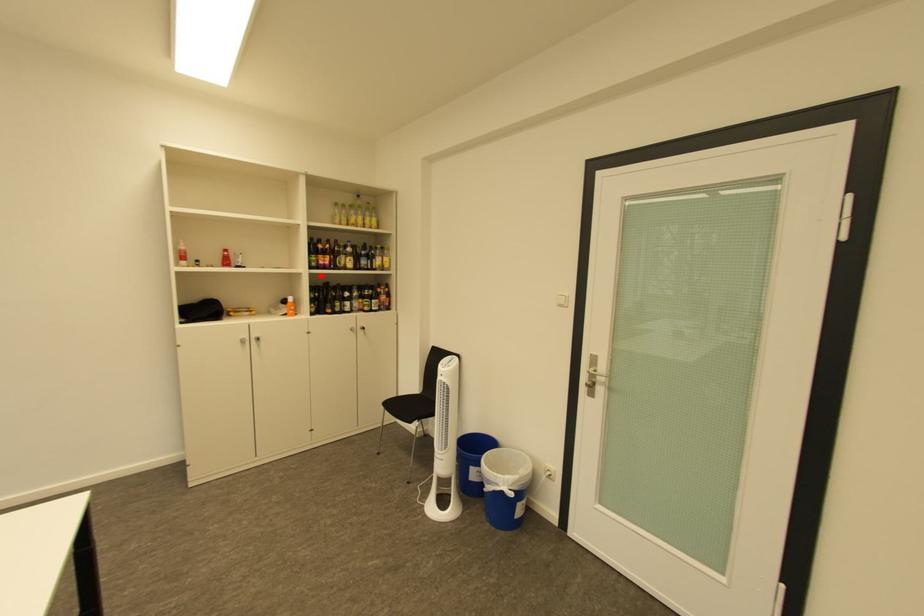
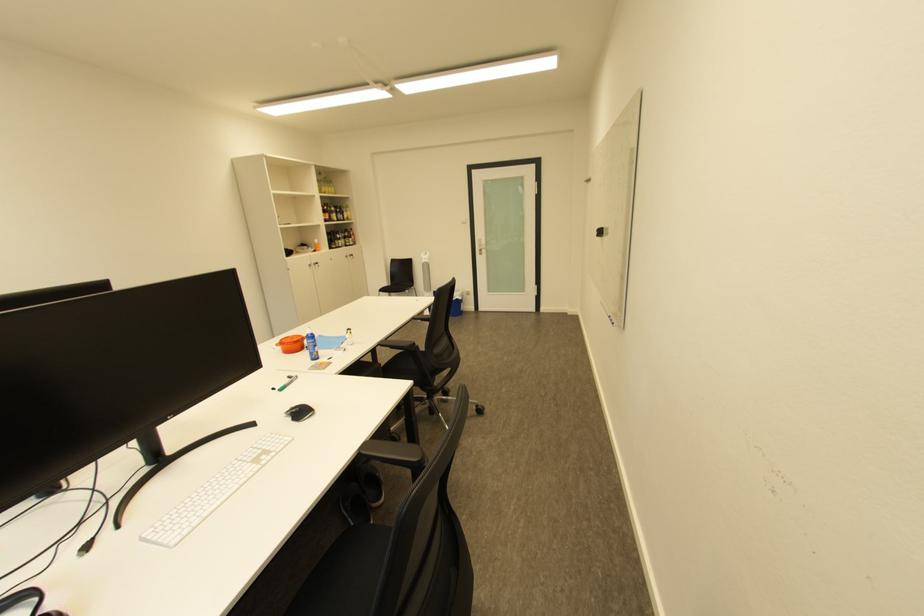
Question: I am providing you with two images of the same scene from different viewpoints. In image1, a red point is highlighted. Considering the same 3D point in image2, which of the following is correct?

Choices:
 (A) It is closer
 (B) It is farther

Answer: (A)